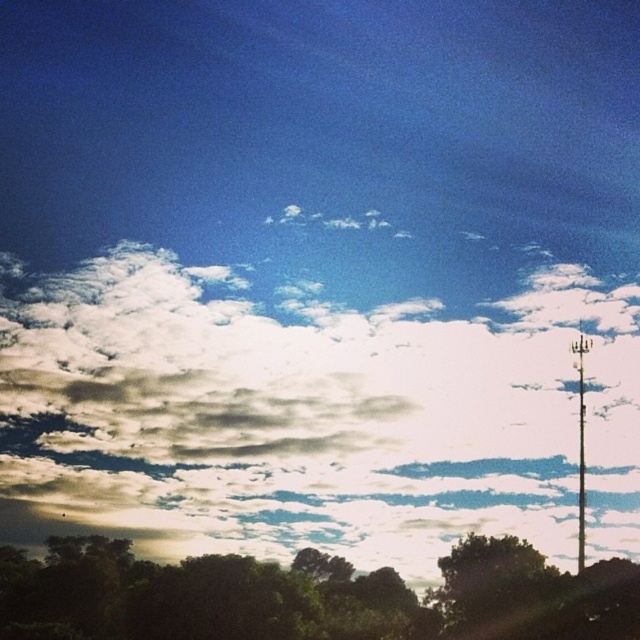
Question: Is the position of white fluffy cloud at upper center more distant than that of green leafy tree at lower center?

Choices:
 (A) no
 (B) yes

Answer: (B)

Question: Which object is closer to the camera taking this photo?

Choices:
 (A) green leafy tree at lower center
 (B) white fluffy cloud at upper center

Answer: (A)

Question: From the image, what is the correct spatial relationship of white fluffy cloud at upper center in relation to metallic pole at right?

Choices:
 (A) right
 (B) left

Answer: (B)

Question: In this image, where is green leafy tree at lower center located relative to metallic pole at right?

Choices:
 (A) above
 (B) below

Answer: (B)

Question: Which object appears closest to the camera in this image?

Choices:
 (A) green leafy tree at lower center
 (B) metallic pole at right
 (C) white fluffy cloud at upper center

Answer: (A)

Question: Based on their relative distances, which object is nearer to the metallic pole at right?

Choices:
 (A) green leafy tree at lower center
 (B) white fluffy cloud at upper center

Answer: (B)